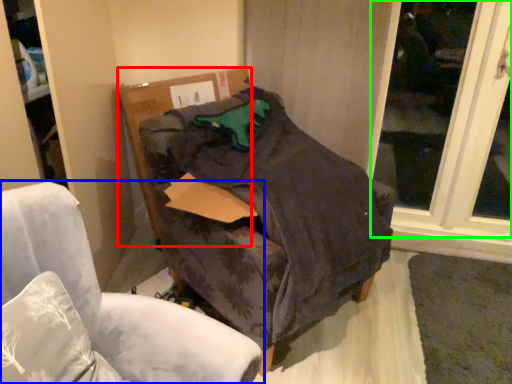
Question: Based on their relative distances, which object is nearer to cardboard box (highlighted by a red box)? Choose from chair (highlighted by a blue box) and window (highlighted by a green box).

Choices:
 (A) chair
 (B) window

Answer: (A)